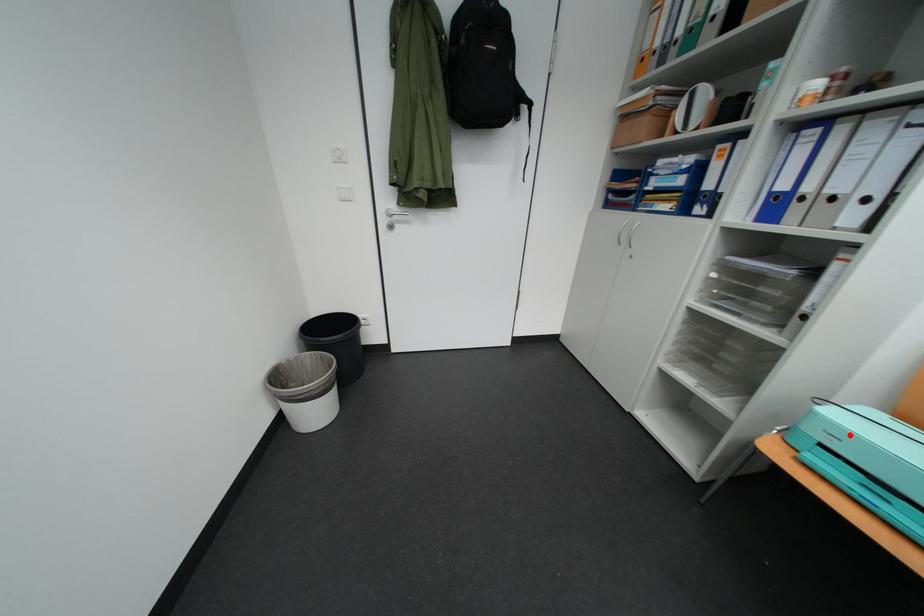
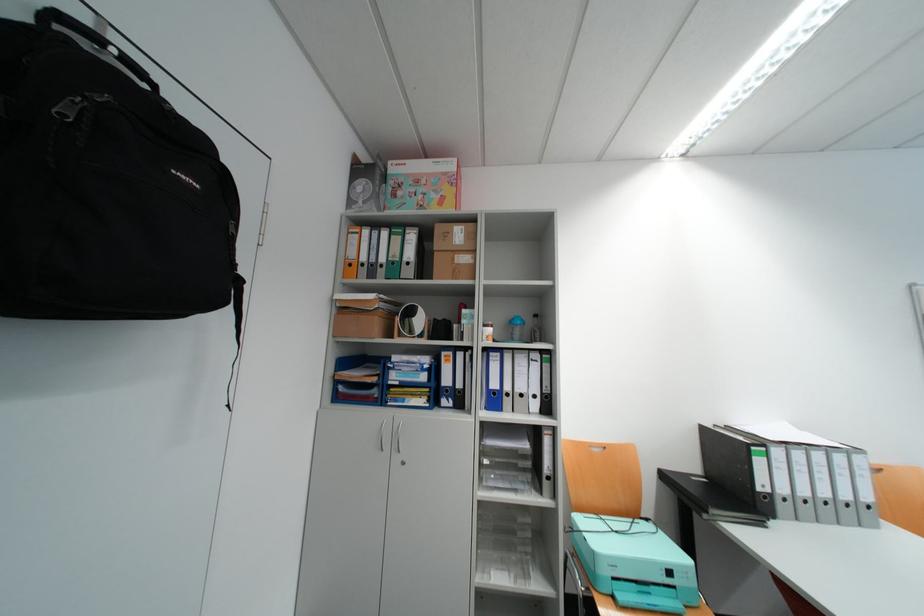
The point at the highlighted location is marked in the first image. Where is the corresponding point in the second image?

(624, 562)